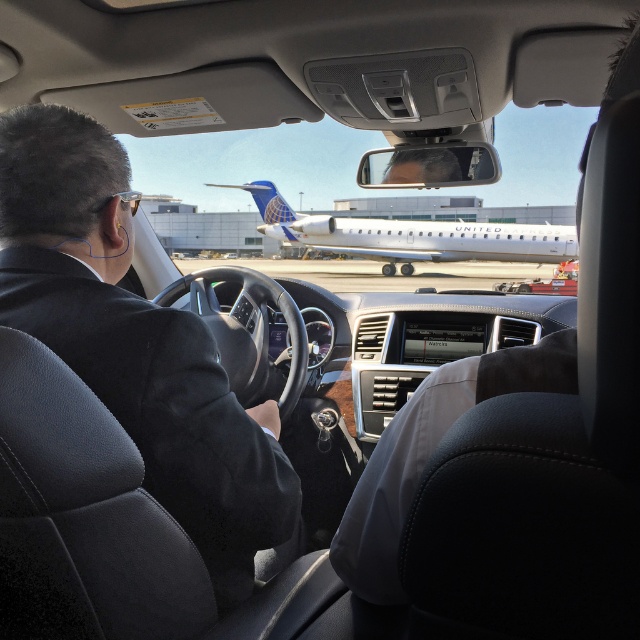
Question: Among these objects, which one is nearest to the camera?

Choices:
 (A) white metallic airplane at center
 (B) dark gray suit at center

Answer: (B)

Question: Is dark gray suit at center to the left of white metallic airplane at center from the viewer's perspective?

Choices:
 (A) yes
 (B) no

Answer: (A)

Question: Is dark gray suit at center smaller than white metallic airplane at center?

Choices:
 (A) no
 (B) yes

Answer: (B)

Question: Where is dark gray suit at center located in relation to white metallic airplane at center in the image?

Choices:
 (A) below
 (B) above

Answer: (A)